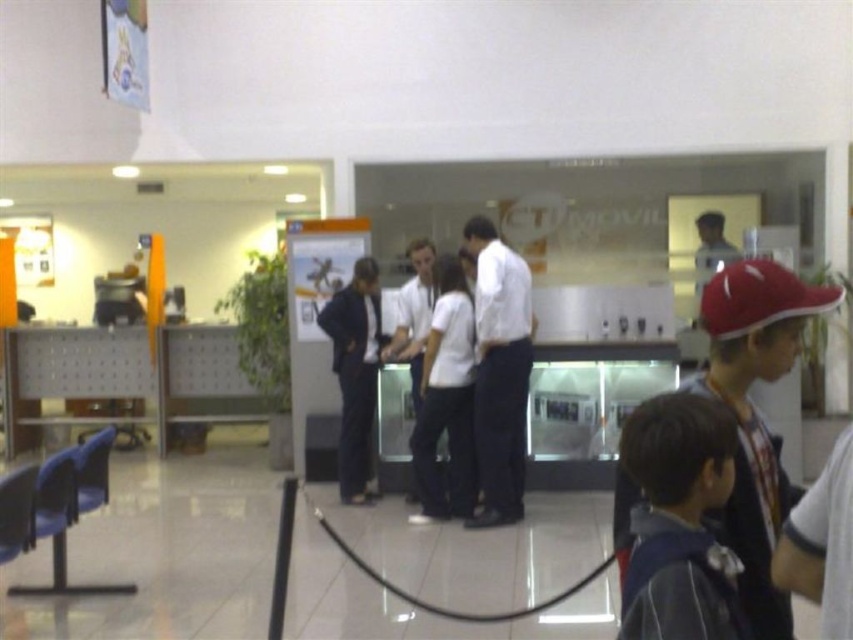
What are the coordinates of the white cotton shirt at center?

The white cotton shirt at center is located at coordinates point (445, 400).

You are a customer trying to approach the counter. There are two employees wearing white shirt at center and white cotton shirt at center. Which employee should you approach first based on their position?

You should approach the white shirt at center first because they are positioned in front of the white cotton shirt at center, making them more accessible from your current position.

You are a customer in this service center and need to approach the counter. There is a white shirt at center and a dark blue suit at center. Which employee should you approach first based on their position?

The white shirt at center is positioned on the right side of dark blue suit at center, so you should approach the white shirt at center first as it is closer to your right side.